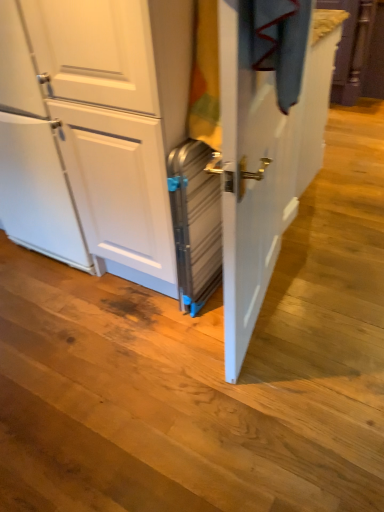
Question: Considering the positions of metallic silver screen door at center and metallic silver suitcase at center in the image, is metallic silver screen door at center wider or thinner than metallic silver suitcase at center?

Choices:
 (A) wide
 (B) thin

Answer: (B)

Question: Would you say metallic silver screen door at center is to the left or to the right of metallic silver suitcase at center in the picture?

Choices:
 (A) left
 (B) right

Answer: (B)

Question: Is metallic silver screen door at center bigger or smaller than metallic silver suitcase at center?

Choices:
 (A) small
 (B) big

Answer: (B)

Question: Does point (206, 251) appear closer or farther from the camera than point (246, 297)?

Choices:
 (A) farther
 (B) closer

Answer: (A)

Question: In terms of width, does metallic silver suitcase at center look wider or thinner when compared to metallic silver screen door at center?

Choices:
 (A) wide
 (B) thin

Answer: (A)

Question: Is metallic silver suitcase at center bigger or smaller than metallic silver screen door at center?

Choices:
 (A) small
 (B) big

Answer: (A)

Question: From a real-world perspective, relative to metallic silver screen door at center, is metallic silver suitcase at center vertically above or below?

Choices:
 (A) above
 (B) below

Answer: (B)